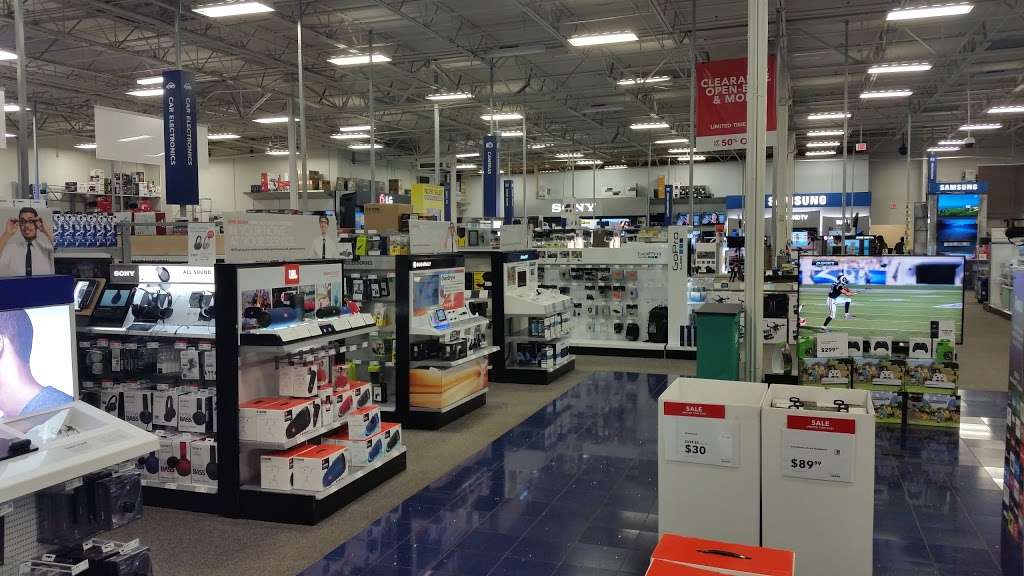
Image resolution: width=1024 pixels, height=576 pixels. Find the location of `blue glossy floor`. blue glossy floor is located at coordinates (570, 509).